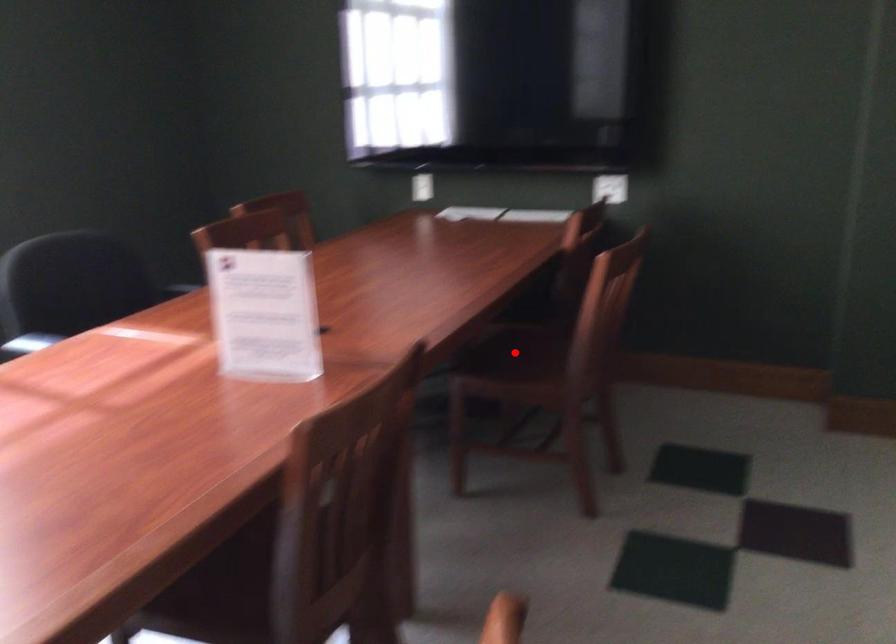
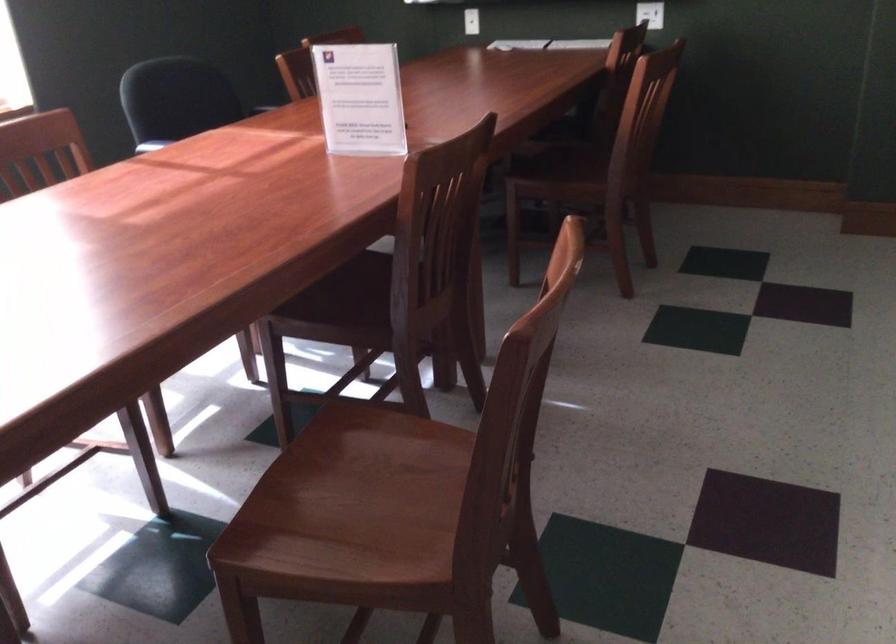
Locate, in the second image, the point that corresponds to the highlighted location in the first image.

(561, 158)